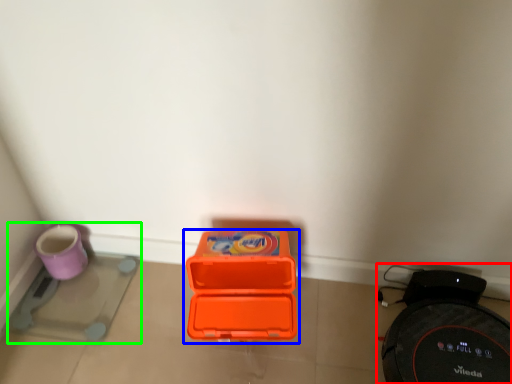
Question: Based on their relative distances, which object is nearer to appliance (highlighted by a red box)? Choose from box (highlighted by a blue box) and appliance (highlighted by a green box).

Choices:
 (A) box
 (B) appliance

Answer: (A)